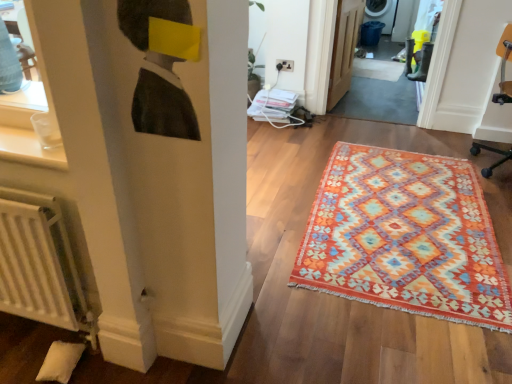
Question: Is wooden door at center oriented away from multicolored woven rug at center?

Choices:
 (A) yes
 (B) no

Answer: (B)

Question: Is wooden door at center bigger than multicolored woven rug at center?

Choices:
 (A) no
 (B) yes

Answer: (B)

Question: Does wooden door at center appear on the left side of multicolored woven rug at center?

Choices:
 (A) yes
 (B) no

Answer: (A)

Question: Could you tell me if wooden door at center is facing multicolored woven rug at center?

Choices:
 (A) no
 (B) yes

Answer: (A)

Question: Can you confirm if wooden door at center is thinner than multicolored woven rug at center?

Choices:
 (A) yes
 (B) no

Answer: (A)

Question: Is wooden door at center to the right of multicolored woven rug at center from the viewer's perspective?

Choices:
 (A) no
 (B) yes

Answer: (A)

Question: From a real-world perspective, is wooden door at center physically above white matte radiator at lower left?

Choices:
 (A) yes
 (B) no

Answer: (A)

Question: Considering the relative sizes of wooden door at center and white matte radiator at lower left in the image provided, is wooden door at center smaller than white matte radiator at lower left?

Choices:
 (A) no
 (B) yes

Answer: (A)

Question: Can you confirm if wooden door at center is bigger than white matte radiator at lower left?

Choices:
 (A) no
 (B) yes

Answer: (B)

Question: Can you confirm if wooden door at center is wider than white matte radiator at lower left?

Choices:
 (A) yes
 (B) no

Answer: (A)

Question: From a real-world perspective, is wooden door at center beneath white matte radiator at lower left?

Choices:
 (A) no
 (B) yes

Answer: (A)

Question: Is wooden door at center positioned before white matte radiator at lower left?

Choices:
 (A) yes
 (B) no

Answer: (B)

Question: Is orange fabric swivel chair at right positioned far away from multicolored woven rug at center?

Choices:
 (A) no
 (B) yes

Answer: (B)